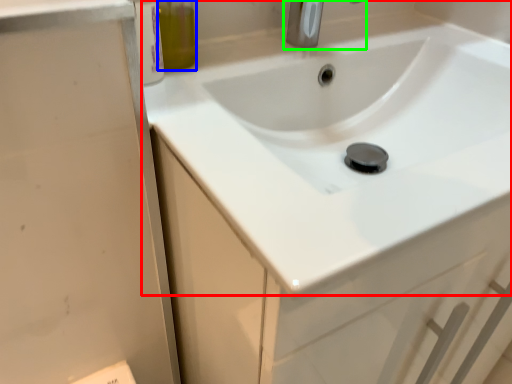
Question: Which object is the farthest from sink (highlighted by a red box)? Choose among these: olive oil (highlighted by a blue box) or tap (highlighted by a green box).

Choices:
 (A) olive oil
 (B) tap

Answer: (A)